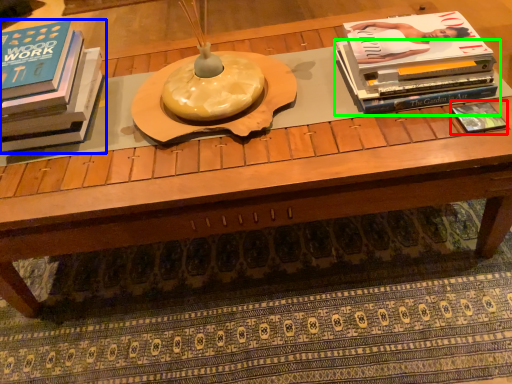
Question: Estimate the real-world distances between objects in this image. Which object is closer to book (highlighted by a red box), book (highlighted by a blue box) or book (highlighted by a green box)?

Choices:
 (A) book
 (B) book

Answer: (B)